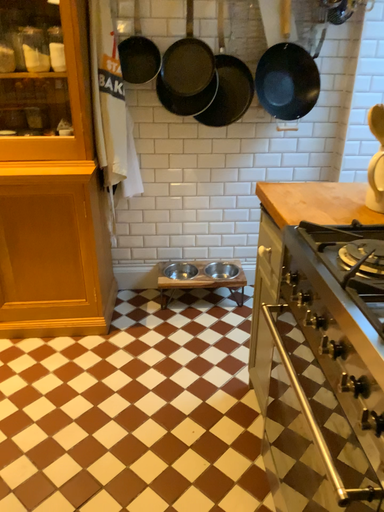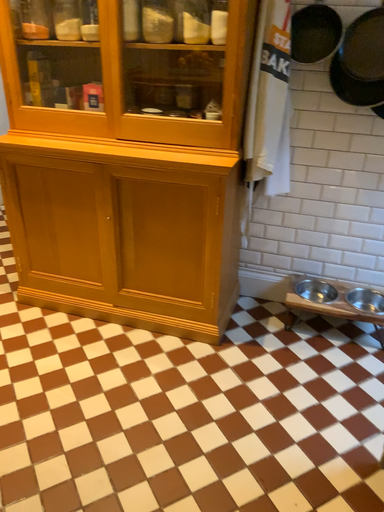
Question: How did the camera likely rotate when shooting the video?

Choices:
 (A) rotated right
 (B) rotated left

Answer: (B)